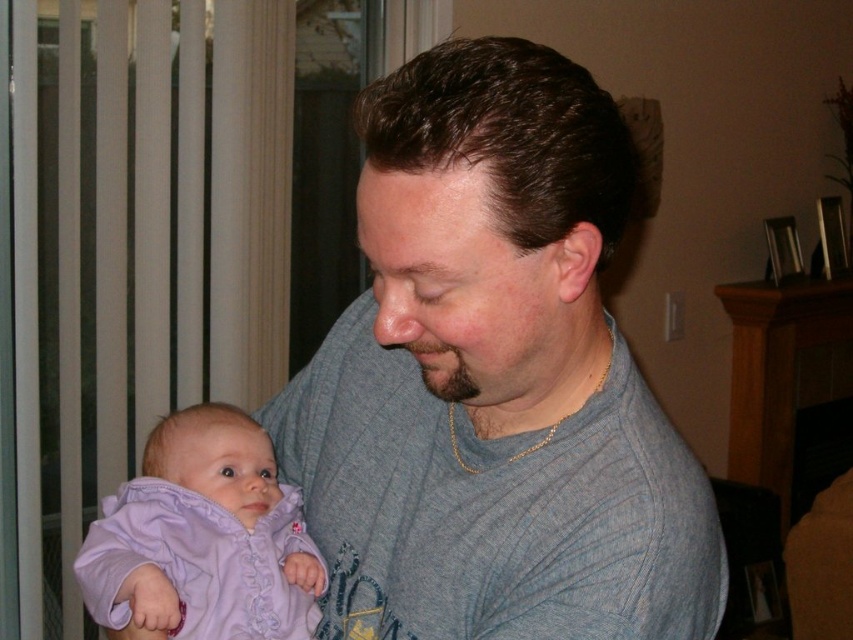
Is gray knit sweater at center to the right of lavender soft fabric baby at left from the viewer's perspective?

Correct, you'll find gray knit sweater at center to the right of lavender soft fabric baby at left.

Is point (491, 506) positioned behind point (115, 621)?

That is False.

Which is in front, point (631, 170) or point (300, 541)?

Point (631, 170) is more forward.

I want to click on gray knit sweater at center, so click(494, 378).